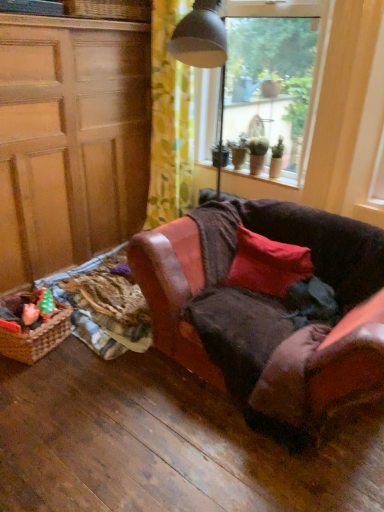
What is the approximate height of smooth wooden window sill at upper center?

1.63 inches.

Image resolution: width=384 pixels, height=512 pixels. Find the location of `smooth wooden window sill at upper center`. smooth wooden window sill at upper center is located at coordinates (255, 186).

Describe the element at coordinates (39, 307) in the screenshot. Image resolution: width=384 pixels, height=512 pixels. I see `plush pink toy at lower left` at that location.

The width and height of the screenshot is (384, 512). What do you see at coordinates (276, 159) in the screenshot? I see `green matte houseplant at upper right, which appears as the 1th houseplant when viewed from the right` at bounding box center [276, 159].

Describe the element at coordinates (170, 120) in the screenshot. The height and width of the screenshot is (512, 384). I see `yellow floral fabric at upper center` at that location.

Describe the element at coordinates (276, 74) in the screenshot. I see `transparent glass window at upper center` at that location.

Identify the location of smooth wooden window sill at upper center. The height and width of the screenshot is (512, 384). (255, 186).

Does matte red pillow at center come in front of plush pink toy at lower left?

Yes, it is.

Which object is positioned more to the left, matte red pillow at center or plush pink toy at lower left?

Positioned to the left is plush pink toy at lower left.

Is point (288, 257) less distant than point (54, 304)?

That is True.

Considering the sizes of objects woven brown picnic basket at lower left and green matte plant at upper right, acting as the 1th houseplant starting from the left, in the image provided, who is smaller, woven brown picnic basket at lower left or green matte plant at upper right, acting as the 1th houseplant starting from the left,?

Smaller between the two is green matte plant at upper right, acting as the 1th houseplant starting from the left.

Considering the points (23, 354) and (264, 137), which point is in front, point (23, 354) or point (264, 137)?

Point (23, 354)

Is woven brown picnic basket at lower left shorter than green matte plant at upper right, acting as the 1th houseplant starting from the left?

Yes, woven brown picnic basket at lower left is shorter than green matte plant at upper right, acting as the 1th houseplant starting from the left.

At what (x,y) coordinates should I click in order to perform the action: click on the 1st houseplant above the woven brown picnic basket at lower left (from a real-world perspective). Please return your answer as a coordinate pair (x, y). The width and height of the screenshot is (384, 512). Looking at the image, I should click on pos(257,154).

The width and height of the screenshot is (384, 512). What are the coordinates of `window that is above the yellow floral fabric at upper center (from a real-world perspective)` in the screenshot? It's located at (276, 74).

Choose the correct answer: Is yellow floral fabric at upper center inside transparent glass window at upper center or outside it?

yellow floral fabric at upper center cannot be found inside transparent glass window at upper center.

Considering the positions of objects yellow floral fabric at upper center and transparent glass window at upper center in the image provided, who is in front, yellow floral fabric at upper center or transparent glass window at upper center?

Positioned in front is transparent glass window at upper center.

Does point (171, 207) appear closer or farther from the camera than point (311, 75)?

Point (171, 207).

Considering the relative positions of woven brown picnic basket at lower left and smooth wooden window sill at upper center in the image provided, is woven brown picnic basket at lower left to the left or to the right of smooth wooden window sill at upper center?

woven brown picnic basket at lower left is to the left of smooth wooden window sill at upper center.

Is woven brown picnic basket at lower left inside the boundaries of smooth wooden window sill at upper center, or outside?

woven brown picnic basket at lower left cannot be found inside smooth wooden window sill at upper center.

From a real-world perspective, which object rests below the other?

woven brown picnic basket at lower left is physically lower.

Is woven brown picnic basket at lower left smaller than smooth wooden window sill at upper center?

Actually, woven brown picnic basket at lower left might be larger than smooth wooden window sill at upper center.

Is woven wicker basket at upper left oriented towards woven brown picnic basket at lower left?

No, woven wicker basket at upper left is not turned towards woven brown picnic basket at lower left.

Can you confirm if woven wicker basket at upper left is wider than woven brown picnic basket at lower left?

Indeed, woven wicker basket at upper left has a greater width compared to woven brown picnic basket at lower left.

Would you say woven wicker basket at upper left is outside woven brown picnic basket at lower left?

Yes, woven wicker basket at upper left is located beyond the bounds of woven brown picnic basket at lower left.

Which is correct: smooth wooden window sill at upper center is inside yellow floral fabric at upper center, or outside of it?

The correct answer is: outside.

This screenshot has width=384, height=512. I want to click on curtain on the left of smooth wooden window sill at upper center, so click(x=170, y=120).

In the scene shown: Between smooth wooden window sill at upper center and yellow floral fabric at upper center, which one has larger width?

yellow floral fabric at upper center is wider.

Between green matte houseplant at upper right, which appears as the 1th houseplant when viewed from the right, and woven brown picnic basket at lower left, which one has less height?

Standing shorter between the two is woven brown picnic basket at lower left.

Could you measure the distance between green matte houseplant at upper right, which appears as the 1th houseplant when viewed from the right, and woven brown picnic basket at lower left?

The distance of green matte houseplant at upper right, which appears as the 1th houseplant when viewed from the right, from woven brown picnic basket at lower left is 5.93 feet.

Which object is wider, green matte houseplant at upper right, which appears as the 1th houseplant when viewed from the right, or woven brown picnic basket at lower left?

woven brown picnic basket at lower left is wider.

Is green matte houseplant at upper right, acting as the 2th houseplant starting from the left, far away from woven brown picnic basket at lower left?

green matte houseplant at upper right, acting as the 2th houseplant starting from the left, is positioned a significant distance from woven brown picnic basket at lower left.

Locate an element on the screen. pillow in front of the plush pink toy at lower left is located at coordinates (267, 264).

The height and width of the screenshot is (512, 384). In the image, there is a green matte plant at upper right, which ranks as the 2th houseplant in right-to-left order. Find the location of `picnic basket below it (from a real-world perspective)`. picnic basket below it (from a real-world perspective) is located at coordinates (37, 337).

Based on the photo, estimate the real-world distances between objects in this image. Which object is further from matte wood cabinet at left, smooth wooden window sill at upper center or plush pink toy at lower left?

Based on the image, smooth wooden window sill at upper center appears to be further to matte wood cabinet at left.

Considering their positions, is transparent glass window at upper center positioned closer to green matte plant at upper right, acting as the 1th houseplant starting from the left, than plush pink toy at lower left?

transparent glass window at upper center is positioned closer to the anchor green matte plant at upper right, acting as the 1th houseplant starting from the left.

When comparing their distances from plush pink toy at lower left, does leather couch at center or green matte plant at upper right, acting as the 1th houseplant starting from the left, seem further?

green matte plant at upper right, acting as the 1th houseplant starting from the left, is further to plush pink toy at lower left.

Based on their spatial positions, is green matte plant at upper right, acting as the 1th houseplant starting from the left, or leather couch at center further from matte red pillow at center?

green matte plant at upper right, acting as the 1th houseplant starting from the left, lies further to matte red pillow at center than the other object.

Based on their spatial positions, is green matte houseplant at upper right, which appears as the 1th houseplant when viewed from the right, or green matte plant at upper right, acting as the 1th houseplant starting from the left, closer to yellow floral fabric at upper center?

The object closer to yellow floral fabric at upper center is green matte plant at upper right, acting as the 1th houseplant starting from the left.

When comparing their distances from matte red pillow at center, does woven brown picnic basket at lower left or transparent glass window at upper center seem closer?

transparent glass window at upper center is positioned closer to the anchor matte red pillow at center.

When comparing their distances from transparent glass window at upper center, does green matte houseplant at upper right, acting as the 2th houseplant starting from the left, or yellow floral fabric at upper center seem further?

Among the two, green matte houseplant at upper right, acting as the 2th houseplant starting from the left, is located further to transparent glass window at upper center.

From the image, which object appears to be farther from woven brown picnic basket at lower left, plush pink toy at lower left or woven wicker basket at upper left?

woven wicker basket at upper left lies further to woven brown picnic basket at lower left than the other object.

Where is `studio couch between woven wicker basket at upper left and plush pink toy at lower left in the up-down direction`? The image size is (384, 512). studio couch between woven wicker basket at upper left and plush pink toy at lower left in the up-down direction is located at coordinates (266, 313).

What are the coordinates of `window between yellow floral fabric at upper center and green matte plant at upper right, which ranks as the 2th houseplant in right-to-left order` in the screenshot? It's located at (276, 74).

Locate an element on the screen. pillow between woven wicker basket at upper left and plush pink toy at lower left vertically is located at coordinates (267, 264).

Where is `curtain between matte wood cabinet at left and smooth wooden window sill at upper center from left to right`? curtain between matte wood cabinet at left and smooth wooden window sill at upper center from left to right is located at coordinates (170, 120).